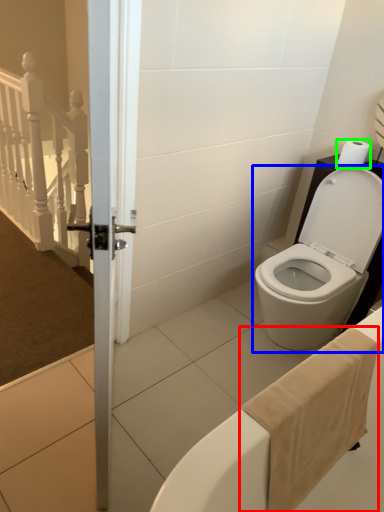
Question: Estimate the real-world distances between objects in this image. Which object is farther from bath towel (highlighted by a red box), toilet (highlighted by a blue box) or toilet paper (highlighted by a green box)?

Choices:
 (A) toilet
 (B) toilet paper

Answer: (B)